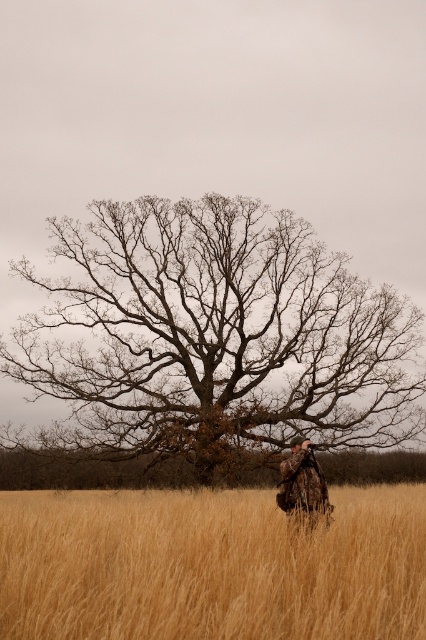
You are a photographer trying to capture the camouflage fabric at center and the bare branches at center in the same frame. Which object should you focus on first to ensure both are in focus?

You should focus on the bare branches at center first because it is closer to the viewer than the camouflage fabric at center, allowing both to be in focus when using depth of field appropriately.

You are a photographer trying to capture the golden grass at center and the camouflage fabric at center in your shot. Which object should you focus on first to ensure both are in frame?

Since the golden grass at center is in front of the camouflage fabric at center, you should focus on the golden grass at center first to ensure both are in frame.

You are a photographer trying to capture the golden grass at center and the camouflage fabric at center in the same frame. Based on their positions, which object should you adjust your camera to focus on first to ensure both are in the shot?

Since the golden grass at center is to the left of the camouflage fabric at center, you should focus on the camouflage fabric at center first to ensure both objects are included in the frame.